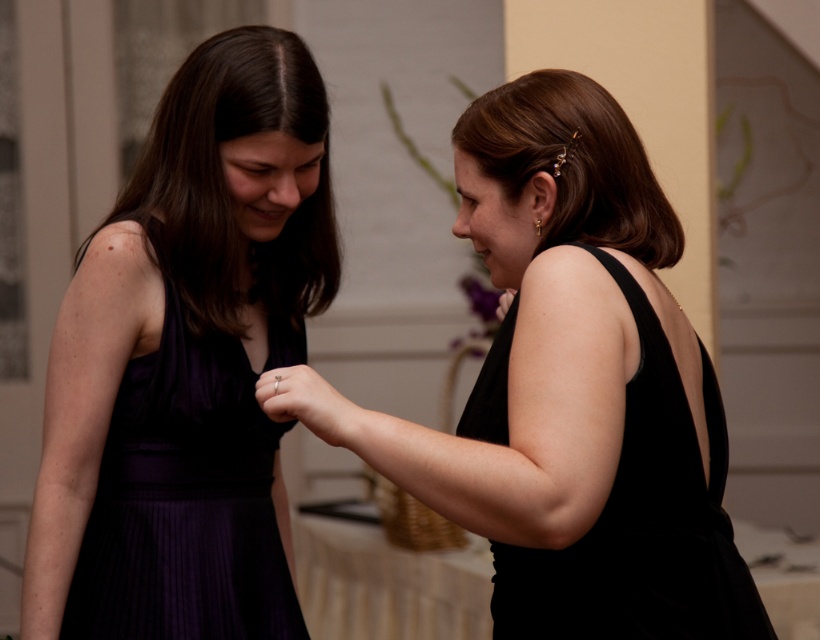
Does point (518, 172) come farther from viewer compared to point (276, 404)?

That is True.

Does shiny gold hairpin at right have a greater height compared to matte gold ring at center?

Yes.

Describe the element at coordinates (574, 163) in the screenshot. I see `shiny gold hairpin at right` at that location.

Where is `shiny gold hairpin at right`? This screenshot has width=820, height=640. shiny gold hairpin at right is located at coordinates click(574, 163).

Does matte purple dress at left appear on the left side of matte black hand at center?

Indeed, matte purple dress at left is positioned on the left side of matte black hand at center.

Where is `matte purple dress at left`? matte purple dress at left is located at coordinates (226, 188).

The image size is (820, 640). Describe the element at coordinates (226, 188) in the screenshot. I see `matte purple dress at left` at that location.

Identify the location of matte purple dress at left. (226, 188).

Is point (668, 458) positioned before point (358, 413)?

No, (668, 458) is further to viewer.

Does black satin dress at right have a lesser width compared to matte gold ring at center?

Incorrect, black satin dress at right's width is not less than matte gold ring at center's.

Is point (713, 461) positioned behind point (348, 428)?

That is True.

The height and width of the screenshot is (640, 820). In order to click on black satin dress at right in this screenshot , I will do `click(641, 524)`.